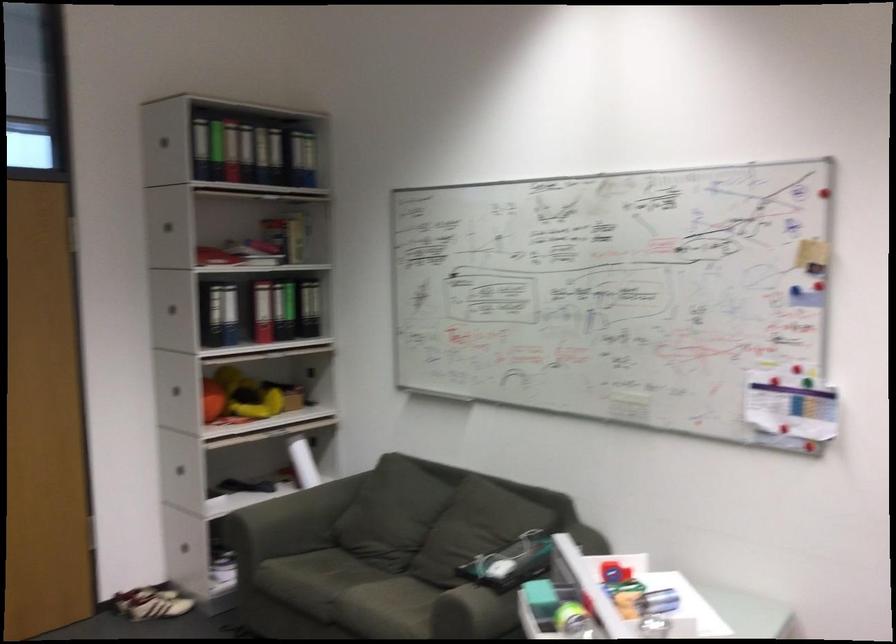
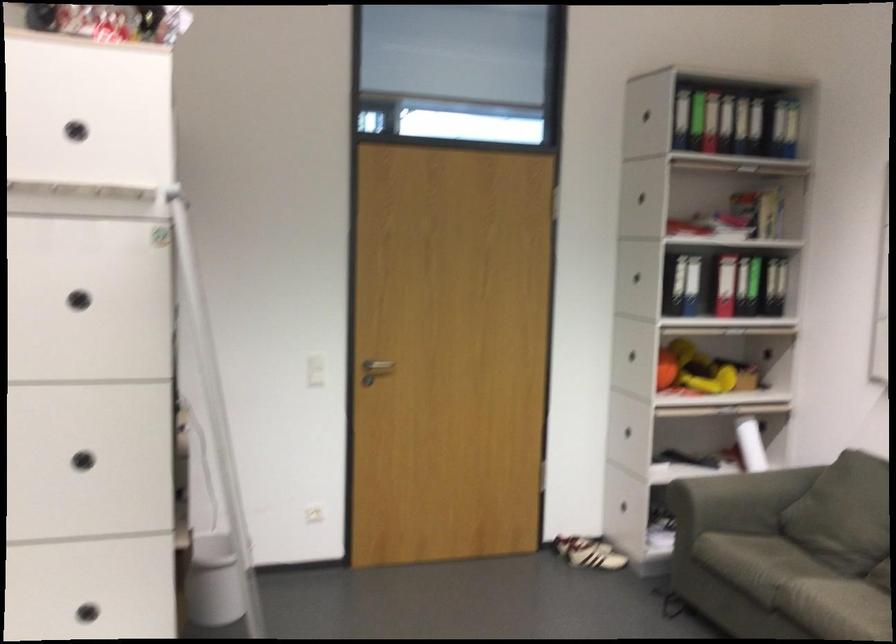
In the second image, find the point that corresponds to point (307, 327) in the first image.

(773, 286)